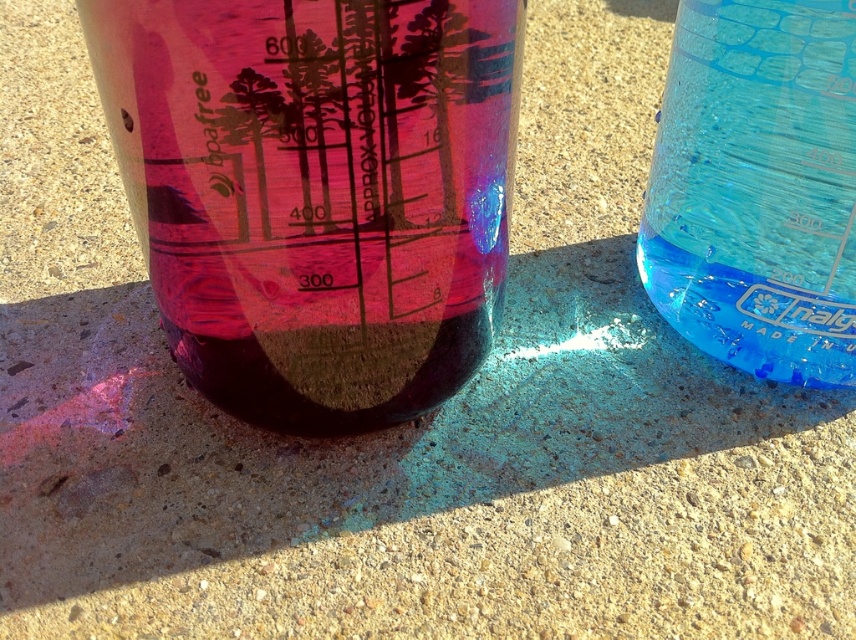
Does transparent plastic beaker at left lie in front of transparent blue beaker at right?

Yes, transparent plastic beaker at left is in front of transparent blue beaker at right.

Can you confirm if transparent plastic beaker at left is positioned below transparent blue beaker at right?

Indeed, transparent plastic beaker at left is positioned under transparent blue beaker at right.

This screenshot has height=640, width=856. Describe the element at coordinates (316, 193) in the screenshot. I see `transparent plastic beaker at left` at that location.

This screenshot has height=640, width=856. In order to click on transparent plastic beaker at left in this screenshot , I will do `click(316, 193)`.